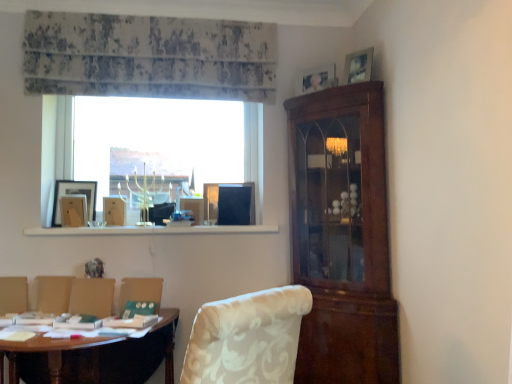
What is the approximate height of white floral fabric armchair at lower center, arranged as the first armchair when viewed from the right?

white floral fabric armchair at lower center, arranged as the first armchair when viewed from the right, is 7.32 inches tall.

Where is `white textured fabric at upper center`? white textured fabric at upper center is located at coordinates (148, 57).

The width and height of the screenshot is (512, 384). I want to click on white glossy window sill at center, so click(x=151, y=230).

Where is `clear glass window at center`? This screenshot has width=512, height=384. clear glass window at center is located at coordinates (162, 141).

Based on the photo, could you tell me if white glossy window sill at center is facing white textured fabric at upper center?

No, white glossy window sill at center is not facing towards white textured fabric at upper center.

Considering the sizes of objects white glossy window sill at center and white textured fabric at upper center in the image provided, who is smaller, white glossy window sill at center or white textured fabric at upper center?

white glossy window sill at center is smaller.

How distant is white glossy window sill at center from white textured fabric at upper center?

35.49 inches.

In the scene shown: In terms of width, does white glossy window sill at center look wider or thinner when compared to white textured fabric at upper center?

Considering their sizes, white glossy window sill at center looks broader than white textured fabric at upper center.

Considering the sizes of white glossy window sill at center and wooden picture frame at upper right, which ranks as the 4th picture frame in bottom-to-top order, in the image, is white glossy window sill at center wider or thinner than wooden picture frame at upper right, which ranks as the 4th picture frame in bottom-to-top order,?

Considering their sizes, white glossy window sill at center looks broader than wooden picture frame at upper right, which ranks as the 4th picture frame in bottom-to-top order.

Which of these two, white glossy window sill at center or wooden picture frame at upper right, which is the fourth picture frame in left-to-right order, is smaller?

Smaller between the two is wooden picture frame at upper right, which is the fourth picture frame in left-to-right order.

Does white glossy window sill at center appear on the left side of wooden picture frame at upper right, which is the fourth picture frame in left-to-right order?

Yes, white glossy window sill at center is to the left of wooden picture frame at upper right, which is the fourth picture frame in left-to-right order.

In the scene shown: Could you tell me if white textured fabric at upper center is facing white floral fabric armchair at lower left, placed as the 2th armchair when sorted from left to right?

No, white textured fabric at upper center does not turn towards white floral fabric armchair at lower left, placed as the 2th armchair when sorted from left to right.

Are white textured fabric at upper center and white floral fabric armchair at lower left, positioned as the 3th armchair in right-to-left order, located far from each other?

Indeed, white textured fabric at upper center is not near white floral fabric armchair at lower left, positioned as the 3th armchair in right-to-left order.

Looking at this image, from the image's perspective, between white textured fabric at upper center and white floral fabric armchair at lower left, placed as the 2th armchair when sorted from left to right, who is located below?

white floral fabric armchair at lower left, placed as the 2th armchair when sorted from left to right.

From a real-world perspective, between white textured fabric at upper center and white floral fabric armchair at lower left, placed as the 2th armchair when sorted from left to right, who is vertically lower?

white floral fabric armchair at lower left, placed as the 2th armchair when sorted from left to right.

Is white floral fabric armchair at lower left, positioned as the 3th armchair in right-to-left order, smaller than white floral fabric armchair at lower center, the second armchair from the right?

Incorrect, white floral fabric armchair at lower left, positioned as the 3th armchair in right-to-left order, is not smaller in size than white floral fabric armchair at lower center, the second armchair from the right.

How many degrees apart are the facing directions of white floral fabric armchair at lower left, placed as the 2th armchair when sorted from left to right, and white floral fabric armchair at lower center, the second armchair from the right?

The facing directions of white floral fabric armchair at lower left, placed as the 2th armchair when sorted from left to right, and white floral fabric armchair at lower center, the second armchair from the right, are 2.18 degrees apart.

Considering the relative positions of white floral fabric armchair at lower left, positioned as the 3th armchair in right-to-left order, and white floral fabric armchair at lower center, arranged as the third armchair when viewed from the left, in the image provided, is white floral fabric armchair at lower left, positioned as the 3th armchair in right-to-left order, to the left of white floral fabric armchair at lower center, arranged as the third armchair when viewed from the left, from the viewer's perspective?

Indeed, white floral fabric armchair at lower left, positioned as the 3th armchair in right-to-left order, is positioned on the left side of white floral fabric armchair at lower center, arranged as the third armchair when viewed from the left.

Is white glossy window sill at center bigger than white floral fabric armchair at lower left, the 4th armchair from the right?

Indeed, white glossy window sill at center has a larger size compared to white floral fabric armchair at lower left, the 4th armchair from the right.

The height and width of the screenshot is (384, 512). In order to click on the 2nd armchair below the white glossy window sill at center (from a real-world perspective) in this screenshot , I will do `click(13, 295)`.

Which object is positioned more to the right, white glossy window sill at center or white floral fabric armchair at lower left, positioned as the first armchair in left-to-right order?

From the viewer's perspective, white glossy window sill at center appears more on the right side.

Which of these two, white glossy window sill at center or wooden picture frame at left, which is the 2th picture frame in bottom-to-top order, is bigger?

white glossy window sill at center is bigger.

Which object is thinner, white glossy window sill at center or wooden picture frame at left, which appears as the 3th picture frame when viewed from the top?

wooden picture frame at left, which appears as the 3th picture frame when viewed from the top, is thinner.

From the image's perspective, which object appears higher, white glossy window sill at center or wooden picture frame at left, which is the 2th picture frame in bottom-to-top order?

wooden picture frame at left, which is the 2th picture frame in bottom-to-top order.

Is white glossy window sill at center facing away from wooden picture frame at left, which appears as the 3th picture frame when viewed from the top?

No, white glossy window sill at center's orientation is not away from wooden picture frame at left, which appears as the 3th picture frame when viewed from the top.

Based on the photo, is wooden picture frame at upper left, placed as the fourth picture frame when sorted from top to bottom, closer to the viewer compared to white textured fabric at upper center?

That is False.

Find the location of a particular element. curtain in front of the wooden picture frame at upper left, which ranks as the second picture frame in left-to-right order is located at coordinates (148, 57).

Is wooden picture frame at upper left, which ranks as the second picture frame in left-to-right order, aimed at white textured fabric at upper center?

No.

From the image's perspective, is wooden picture frame at upper left, the first picture frame ordered from the bottom, located above white textured fabric at upper center?

No.

Image resolution: width=512 pixels, height=384 pixels. Identify the location of window sill below the white textured fabric at upper center (from a real-world perspective). (151, 230).

You are a GUI agent. You are given a task and a screenshot of the screen. Output one action in this format:
    pyautogui.click(x=<x>, y=<y>)
    Task: Click on the 4th picture frame above the white glossy window sill at center (from a real-world perspective)
    The height and width of the screenshot is (384, 512).
    Given the screenshot: What is the action you would take?
    pyautogui.click(x=358, y=66)

From the image, which object appears to be farther from white floral fabric armchair at lower center, the second armchair from the right, white glossy window sill at center or matte silver picture frame at upper right, the second picture frame when ordered from top to bottom?

matte silver picture frame at upper right, the second picture frame when ordered from top to bottom.

Considering their positions, is white textured fabric at upper center positioned further to clear glass window at center than white floral fabric armchair at lower left, positioned as the first armchair in left-to-right order?

white floral fabric armchair at lower left, positioned as the first armchair in left-to-right order, lies further to clear glass window at center than the other object.

From the image, which object appears to be nearer to white floral fabric armchair at lower left, placed as the 2th armchair when sorted from left to right, white floral fabric armchair at lower center, the second armchair from the right, or wooden table at lower left?

white floral fabric armchair at lower center, the second armchair from the right, is closer to white floral fabric armchair at lower left, placed as the 2th armchair when sorted from left to right.

From the image, which object appears to be farther from white textured fabric at upper center, clear glass window at center or white floral fabric armchair at lower left, positioned as the 3th armchair in right-to-left order?

white floral fabric armchair at lower left, positioned as the 3th armchair in right-to-left order.

From the image, which object appears to be nearer to wooden table at lower left, wooden picture frame at upper right, which is counted as the 1th picture frame, starting from the top, or white floral fabric armchair at lower center, arranged as the third armchair when viewed from the left?

The object closer to wooden table at lower left is white floral fabric armchair at lower center, arranged as the third armchair when viewed from the left.

From the image, which object appears to be farther from wooden picture frame at upper left, which ranks as the 3th picture frame in right-to-left order, white floral fabric armchair at lower left, positioned as the first armchair in left-to-right order, or wooden picture frame at left, which is the 2th picture frame in bottom-to-top order?

white floral fabric armchair at lower left, positioned as the first armchair in left-to-right order, is further to wooden picture frame at upper left, which ranks as the 3th picture frame in right-to-left order.

Considering their positions, is white textured fabric at upper center positioned closer to wooden picture frame at upper right, which is the fourth picture frame in left-to-right order, than white floral fabric armchair at lower left, positioned as the 3th armchair in right-to-left order?

white textured fabric at upper center is closer to wooden picture frame at upper right, which is the fourth picture frame in left-to-right order.

Based on their spatial positions, is clear glass window at center or white floral fabric armchair at lower left, positioned as the first armchair in left-to-right order, further from white floral fabric armchair at lower center, arranged as the first armchair when viewed from the right?

Based on the image, clear glass window at center appears to be further to white floral fabric armchair at lower center, arranged as the first armchair when viewed from the right.

The height and width of the screenshot is (384, 512). Identify the location of armchair positioned between wooden table at lower left and white floral fabric armchair at lower center, the second armchair from the right, from near to far. (141, 292).

Locate an element on the screen. Image resolution: width=512 pixels, height=384 pixels. window sill between matte silver picture frame at upper right, which appears as the third picture frame when viewed from the left, and wooden table at lower left vertically is located at coordinates (151, 230).

Locate an element on the screen. window between white floral fabric armchair at lower left, the 4th armchair from the right, and wooden picture frame at upper right, which is counted as the 1th picture frame, starting from the top is located at coordinates (162, 141).

Where is `window between white textured fabric at upper center and wooden table at lower left in the vertical direction`? The width and height of the screenshot is (512, 384). window between white textured fabric at upper center and wooden table at lower left in the vertical direction is located at coordinates coord(162,141).